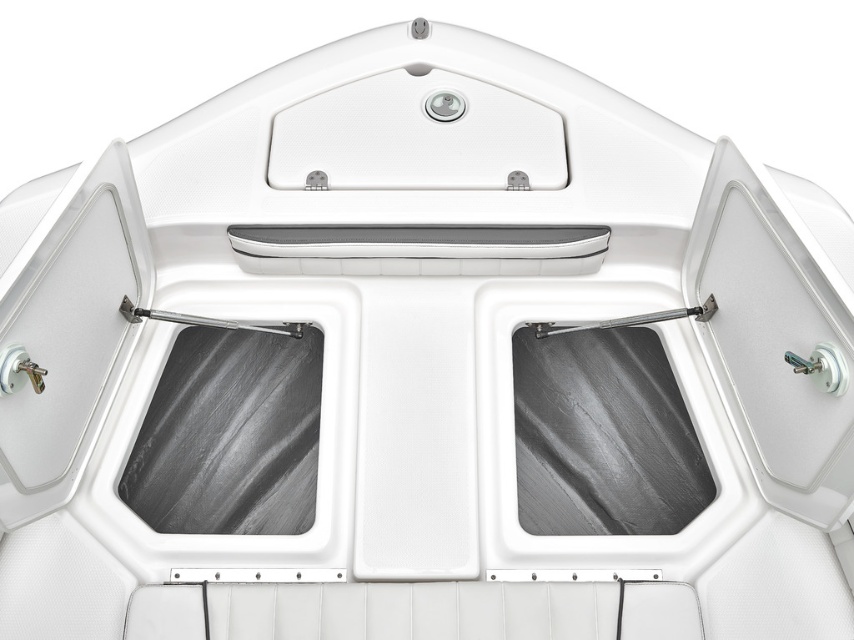
You are designing a storage system for the boat and need to place a rectangular box that is 1 meter wide. You have two options for placement between the black textured window at center and the satin black window at center. Which window would allow the box to fit horizontally without overlapping?

The satin black window at center has a greater width than the black textured window at center, so placing the box next to the satin black window at center would provide enough space for the 1 meter wide box to fit horizontally without overlapping.

In the scene shown: You are a marine technician inspecting the boat storage compartment. You notice two windows labeled as black textured window at center and satin black window at center. Which window is taller?

The black textured window at center is taller than the satin black window at center according to the description.